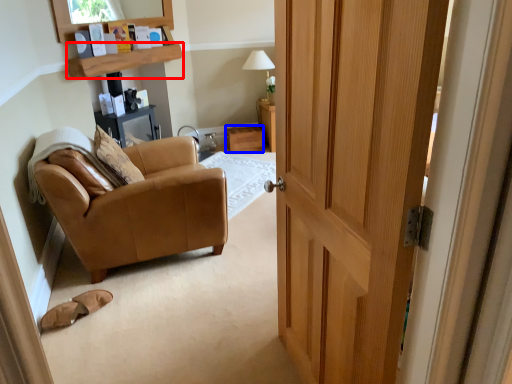
Question: Which object appears farthest to the camera in this image, shelf (highlighted by a red box) or drawer (highlighted by a blue box)?

Choices:
 (A) shelf
 (B) drawer

Answer: (B)